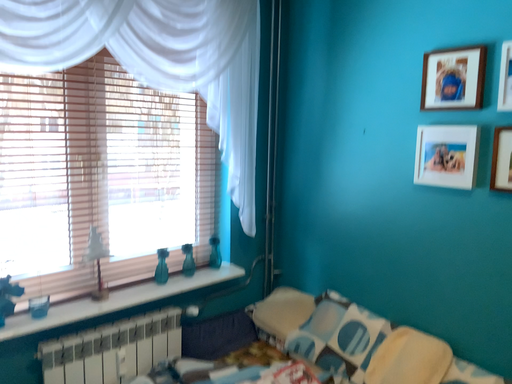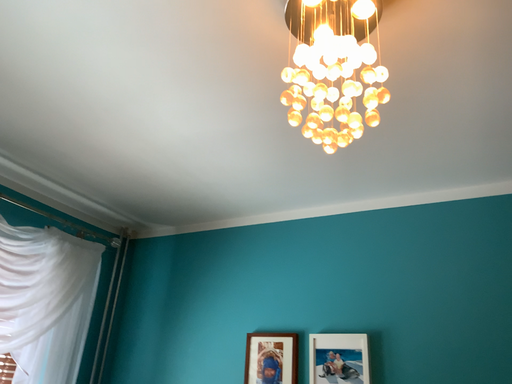
Question: Which way did the camera rotate in the video?

Choices:
 (A) rotated upward
 (B) rotated downward

Answer: (A)